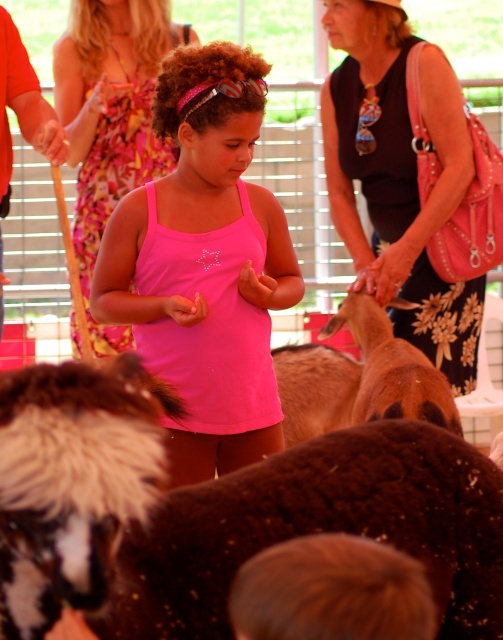
Question: In this image, where is pink matte tank top at center located relative to pink fabric dress at center?

Choices:
 (A) below
 (B) above

Answer: (A)

Question: Among these points, which one is farthest from the camera?

Choices:
 (A) (293, 348)
 (B) (68, 84)

Answer: (A)

Question: Can you confirm if pink matte tank top at center is positioned to the right of pink fabric dress at center?

Choices:
 (A) no
 (B) yes

Answer: (B)

Question: Which point appears farthest from the camera in this image?

Choices:
 (A) (240, 140)
 (B) (120, 28)
 (C) (372, 17)

Answer: (B)

Question: Is pink matte tank top at center bigger than pink fabric dress at center?

Choices:
 (A) yes
 (B) no

Answer: (B)

Question: Among these points, which one is farthest from the camera?

Choices:
 (A) (323, 90)
 (B) (372, 344)
 (C) (111, 161)
 (D) (227, 161)

Answer: (C)